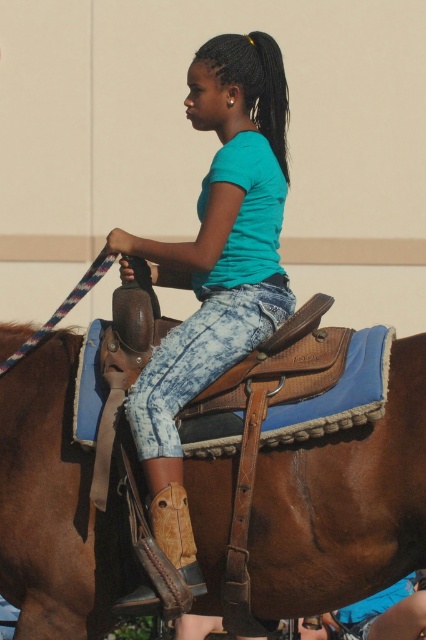
Between point (71, 490) and point (141, 381), which one is positioned in front?

Positioned in front is point (71, 490).

Is brown leather saddle at center shorter than teal matte shirt at center?

Correct, brown leather saddle at center is not as tall as teal matte shirt at center.

Who is more distant from viewer, (201, 538) or (161, 472)?

Point (201, 538)

Locate an element on the screen. The width and height of the screenshot is (426, 640). brown leather saddle at center is located at coordinates (344, 504).